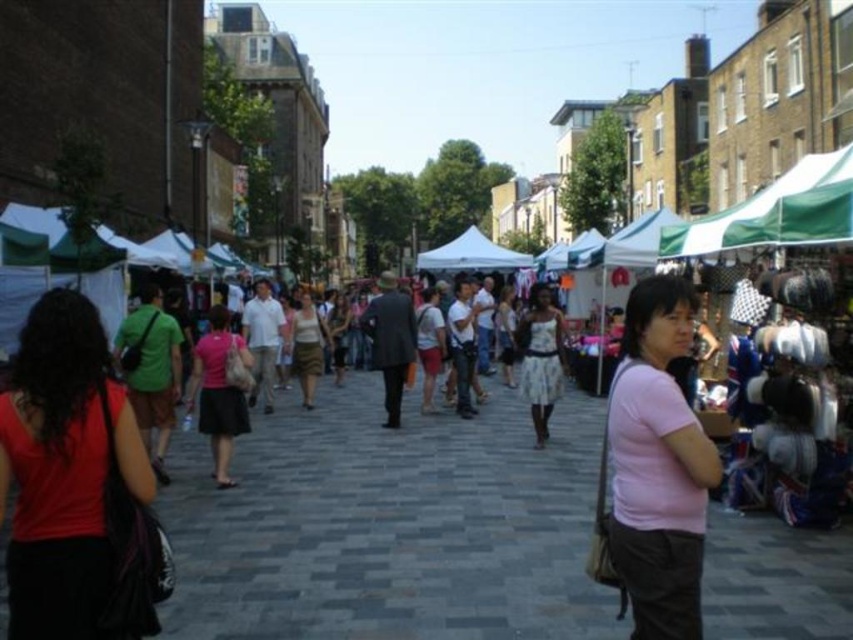
Who is more distant from viewer, (97,525) or (321,326)?

Point (321,326)

Between matte red tank top at left and matte white blouse at center, which one has less height?

Standing shorter between the two is matte white blouse at center.

Who is more distant from viewer, (33, 564) or (309, 317)?

The point (309, 317) is behind.

Locate an element on the screen. This screenshot has height=640, width=853. matte red tank top at left is located at coordinates [62, 472].

Consider the image. How much distance is there between matte red tank top at left and pink matte shirt at center?

matte red tank top at left is 100.77 feet from pink matte shirt at center.

Is matte red tank top at left behind pink matte shirt at center?

That is False.

Who is more forward, [57,580] or [705,472]?

Point [57,580] is more forward.

What are the coordinates of `matte red tank top at left` in the screenshot? It's located at (62, 472).

Which is behind, point (524, 253) or point (502, 292)?

Point (524, 253)

Is white fabric canopy at center wider than matte white dress at center?

Yes, white fabric canopy at center is wider than matte white dress at center.

Measure the distance between point (527, 253) and camera.

Point (527, 253) and camera are 206.05 meters apart.

Where is `white fabric canopy at center`? white fabric canopy at center is located at coordinates (471, 253).